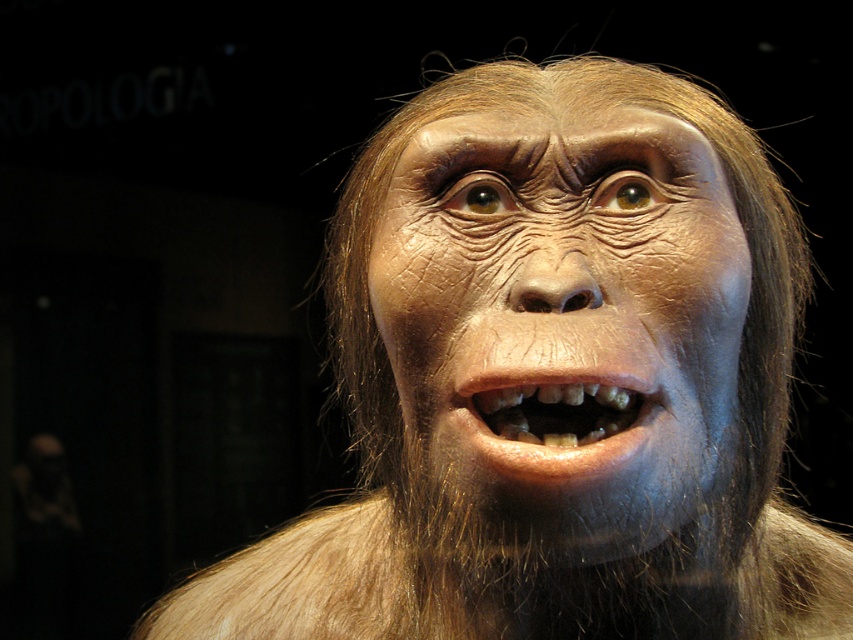
Is matte brown face at center to the right of brown textured teeth at center from the viewer's perspective?

Correct, you'll find matte brown face at center to the right of brown textured teeth at center.

Does matte brown face at center have a lesser width compared to brown textured teeth at center?

Incorrect, matte brown face at center's width is not less than brown textured teeth at center's.

The width and height of the screenshot is (853, 640). I want to click on matte brown face at center, so click(x=566, y=321).